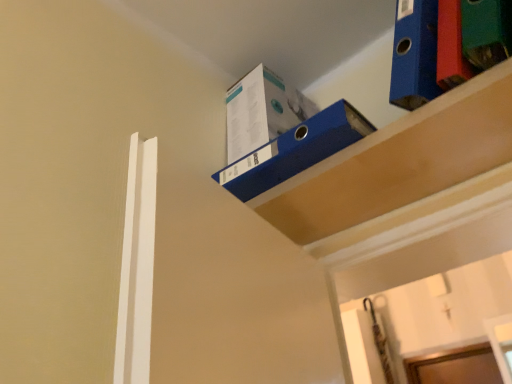
Question: Is blue cardboard box at upper center, marked as the first shelf in a left-to-right arrangement, to the right of blue cardboard box at upper center from the viewer's perspective?

Choices:
 (A) yes
 (B) no

Answer: (A)

Question: Considering the relative sizes of blue cardboard box at upper center, marked as the first shelf in a left-to-right arrangement, and blue cardboard box at upper center in the image provided, is blue cardboard box at upper center, marked as the first shelf in a left-to-right arrangement, shorter than blue cardboard box at upper center?

Choices:
 (A) no
 (B) yes

Answer: (B)

Question: From the image's perspective, is blue cardboard box at upper center, which ranks as the second shelf in right-to-left order, above blue cardboard box at upper center?

Choices:
 (A) yes
 (B) no

Answer: (B)

Question: Are blue cardboard box at upper center, marked as the first shelf in a left-to-right arrangement, and blue cardboard box at upper center making contact?

Choices:
 (A) no
 (B) yes

Answer: (A)

Question: From a real-world perspective, does blue cardboard box at upper center, marked as the first shelf in a left-to-right arrangement, sit lower than blue cardboard box at upper center?

Choices:
 (A) no
 (B) yes

Answer: (B)

Question: Considering the relative sizes of blue cardboard box at upper center, marked as the first shelf in a left-to-right arrangement, and blue cardboard box at upper center in the image provided, is blue cardboard box at upper center, marked as the first shelf in a left-to-right arrangement, smaller than blue cardboard box at upper center?

Choices:
 (A) yes
 (B) no

Answer: (A)

Question: Is blue cardboard box at upper center positioned with its back to blue cardboard box at upper right, the first shelf viewed from the right?

Choices:
 (A) yes
 (B) no

Answer: (B)

Question: Is blue cardboard box at upper center facing towards blue cardboard box at upper right, the 2th shelf from the left?

Choices:
 (A) no
 (B) yes

Answer: (A)

Question: Does blue cardboard box at upper center have a lesser height compared to blue cardboard box at upper right, the first shelf viewed from the right?

Choices:
 (A) no
 (B) yes

Answer: (A)

Question: From a real-world perspective, is blue cardboard box at upper center physically above blue cardboard box at upper right, the first shelf viewed from the right?

Choices:
 (A) no
 (B) yes

Answer: (B)

Question: From a real-world perspective, is blue cardboard box at upper center physically below blue cardboard box at upper right, the first shelf viewed from the right?

Choices:
 (A) no
 (B) yes

Answer: (A)

Question: Is blue cardboard box at upper center wider than blue cardboard box at upper right, the 2th shelf from the left?

Choices:
 (A) no
 (B) yes

Answer: (B)

Question: Does blue cardboard box at upper right, the first shelf viewed from the right, have a greater height compared to blue cardboard box at upper center?

Choices:
 (A) yes
 (B) no

Answer: (B)